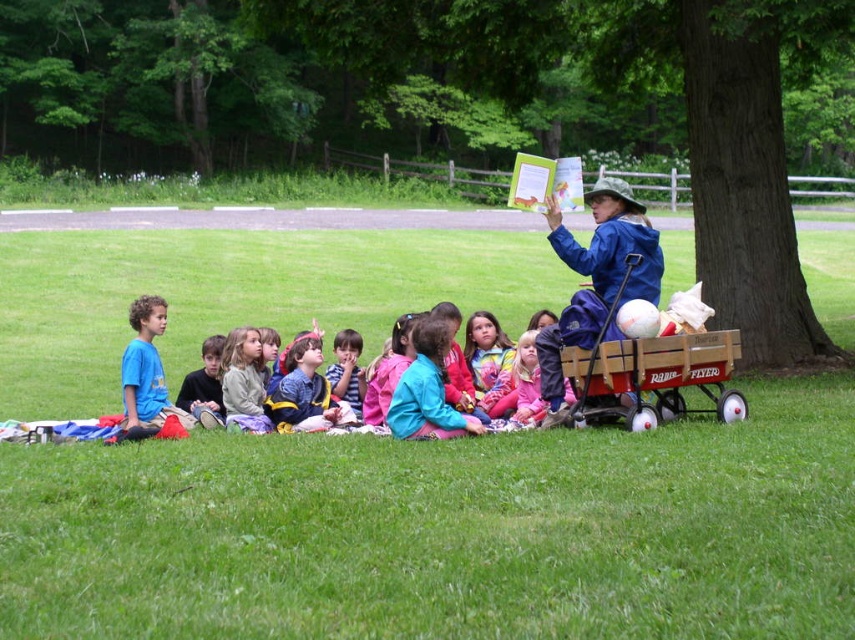
Question: Is blue cotton shirt at center bigger than blue denim jacket at center?

Choices:
 (A) no
 (B) yes

Answer: (B)

Question: Can you confirm if blue t-shirt at left is smaller than blue denim jacket at center?

Choices:
 (A) no
 (B) yes

Answer: (B)

Question: Which of these objects is positioned closest to the blue cotton shirt at center?

Choices:
 (A) wooden wagon at right
 (B) matte blue shirt at lower left

Answer: (B)

Question: Which of the following is the farthest from the observer?

Choices:
 (A) matte blue shirt at lower left
 (B) wooden wagon at right
 (C) matte blue shirt at center
 (D) blue denim jacket at center

Answer: (C)

Question: Estimate the real-world distances between objects in this image. Which object is farther from the blue denim jacket at center?

Choices:
 (A) light gray fleece jacket at lower left
 (B) green rough bark tree at center right
 (C) blue fleece jacket at center

Answer: (B)

Question: Is green grass at lower center thinner than wooden wagon at right?

Choices:
 (A) yes
 (B) no

Answer: (B)